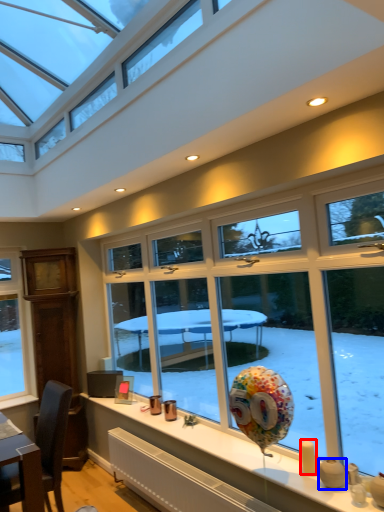
Question: Which object appears farthest to the camera in this image, candle (highlighted by a red box) or candle holder (highlighted by a blue box)?

Choices:
 (A) candle
 (B) candle holder

Answer: (A)